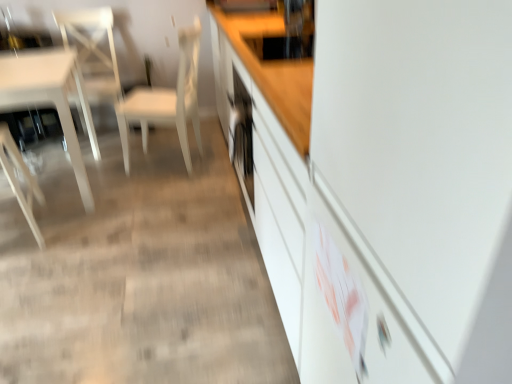
Question: Is white glossy chair at left, the 2th chair when ordered from left to right, oriented towards white matte chair at center, positioned as the 3th chair in left-to-right order?

Choices:
 (A) no
 (B) yes

Answer: (A)

Question: Considering the relative sizes of white glossy chair at left, the 2th chair when ordered from right to left, and white matte chair at center, positioned as the 3th chair in left-to-right order, in the image provided, is white glossy chair at left, the 2th chair when ordered from right to left, thinner than white matte chair at center, positioned as the 3th chair in left-to-right order,?

Choices:
 (A) no
 (B) yes

Answer: (B)

Question: Is white matte chair at center, positioned as the 3th chair in left-to-right order, inside white glossy chair at left, the 2th chair when ordered from left to right?

Choices:
 (A) no
 (B) yes

Answer: (A)

Question: Is white glossy chair at left, the 2th chair when ordered from left to right, wider than white matte chair at center, acting as the 1th chair starting from the right?

Choices:
 (A) no
 (B) yes

Answer: (A)

Question: Considering the relative positions of white glossy chair at left, the 2th chair when ordered from right to left, and white matte chair at center, positioned as the 3th chair in left-to-right order, in the image provided, is white glossy chair at left, the 2th chair when ordered from right to left, behind white matte chair at center, positioned as the 3th chair in left-to-right order,?

Choices:
 (A) yes
 (B) no

Answer: (A)

Question: Is white glossy chair at left, the 2th chair when ordered from left to right, inside the boundaries of white glossy table at left, or outside?

Choices:
 (A) outside
 (B) inside

Answer: (A)

Question: From the image's perspective, is white glossy chair at left, the 2th chair when ordered from right to left, positioned above or below white glossy table at left?

Choices:
 (A) above
 (B) below

Answer: (A)

Question: Considering their positions, is white glossy chair at left, the 2th chair when ordered from left to right, located in front of or behind white glossy table at left?

Choices:
 (A) front
 (B) behind

Answer: (B)

Question: Looking at the image, does white glossy chair at left, the 2th chair when ordered from left to right, seem bigger or smaller compared to white glossy table at left?

Choices:
 (A) small
 (B) big

Answer: (A)

Question: Do you think white glossy cabinet at center is within white glossy chair at left, the 2th chair when ordered from right to left, or outside of it?

Choices:
 (A) outside
 (B) inside

Answer: (A)

Question: Is white glossy cabinet at center bigger or smaller than white glossy chair at left, the 2th chair when ordered from left to right?

Choices:
 (A) small
 (B) big

Answer: (B)

Question: From a real-world perspective, is white glossy cabinet at center physically located above or below white glossy chair at left, the 2th chair when ordered from left to right?

Choices:
 (A) below
 (B) above

Answer: (B)

Question: Considering the positions of white glossy cabinet at center and white glossy chair at left, the 2th chair when ordered from right to left, in the image, is white glossy cabinet at center taller or shorter than white glossy chair at left, the 2th chair when ordered from right to left,?

Choices:
 (A) short
 (B) tall

Answer: (B)

Question: Considering the positions of wooden chair at left, which appears as the third chair when viewed from the right, and white glossy cabinet at center in the image, is wooden chair at left, which appears as the third chair when viewed from the right, wider or thinner than white glossy cabinet at center?

Choices:
 (A) thin
 (B) wide

Answer: (A)

Question: Does point (9, 195) appear closer or farther from the camera than point (474, 119)?

Choices:
 (A) farther
 (B) closer

Answer: (A)